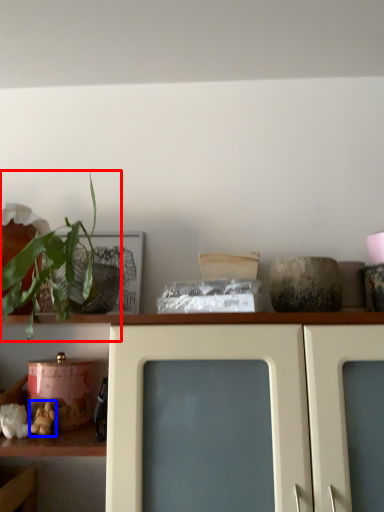
Question: Among these objects, which one is nearest to the camera, houseplant (highlighted by a red box) or stuff (highlighted by a blue box)?

Choices:
 (A) houseplant
 (B) stuff

Answer: (A)